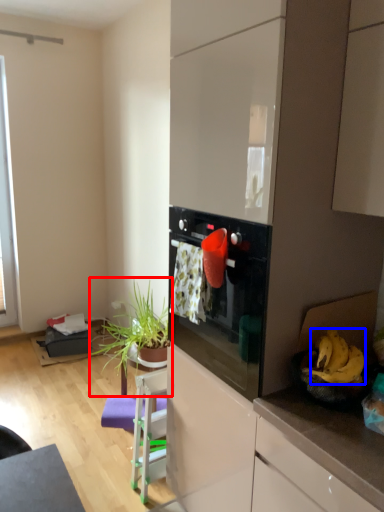
Question: Which point is further to the camera, houseplant (highlighted by a red box) or banana (highlighted by a blue box)?

Choices:
 (A) houseplant
 (B) banana

Answer: (A)